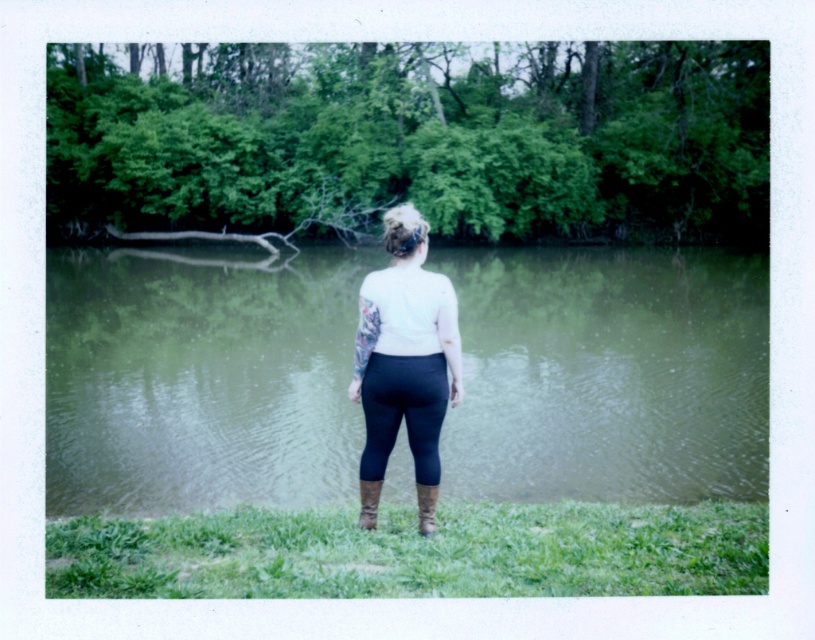
How much distance is there between matte white shirt at center and leather boot at lower center?

The distance of matte white shirt at center from leather boot at lower center is 11.04 inches.

Does matte white shirt at center appear on the right side of leather boot at lower center?

No, matte white shirt at center is not to the right of leather boot at lower center.

The width and height of the screenshot is (815, 640). I want to click on matte white shirt at center, so click(404, 349).

Image resolution: width=815 pixels, height=640 pixels. I want to click on matte white shirt at center, so click(x=404, y=349).

Is black matte leggings at center closer to camera compared to leather boot at lower center?

Yes, it is.

Does black matte leggings at center appear on the right side of leather boot at lower center?

Incorrect, black matte leggings at center is not on the right side of leather boot at lower center.

Who is more distant from viewer, (385, 406) or (435, 528)?

Positioned behind is point (435, 528).

Identify the location of black matte leggings at center. (403, 412).

Consider the image. Is matte white shirt at center smaller than brown suede boot at lower center?

Incorrect, matte white shirt at center is not smaller in size than brown suede boot at lower center.

Can you confirm if matte white shirt at center is thinner than brown suede boot at lower center?

In fact, matte white shirt at center might be wider than brown suede boot at lower center.

Which is behind, point (445, 333) or point (364, 524)?

The point (364, 524) is more distant.

In order to click on matte white shirt at center in this screenshot , I will do `click(404, 349)`.